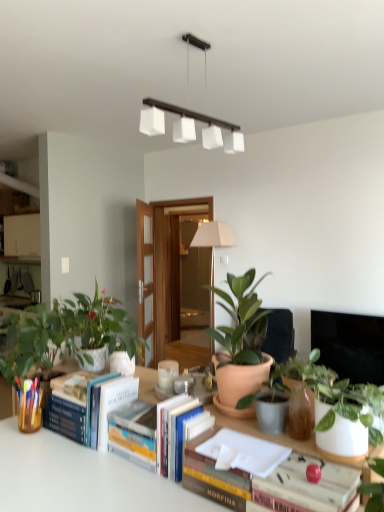
Question: Relative to white matte rectangular light fixture at upper center, is terracotta pot at center, placed as the second houseplant when sorted from right to left, in front or behind?

Choices:
 (A) front
 (B) behind

Answer: (A)

Question: Considering the positions of terracotta pot at center, arranged as the fourth houseplant when viewed from the left, and white matte rectangular light fixture at upper center in the image, is terracotta pot at center, arranged as the fourth houseplant when viewed from the left, taller or shorter than white matte rectangular light fixture at upper center?

Choices:
 (A) tall
 (B) short

Answer: (B)

Question: Which is farther from the hardcover book at center, which is the 2th paperback book in left-to-right order?

Choices:
 (A) green matte plant at left, positioned as the 1th houseplant in left-to-right order
 (B) hardcover book at center, arranged as the 1th book when viewed from the right
 (C) green matte plant at center, arranged as the third houseplant when viewed from the right
 (D) flat screen tv at upper right
 (E) green glossy plant at center, the 1th houseplant in the right-to-left sequence

Answer: (D)

Question: Which of these objects is positioned closest to the green matte plant at center, arranged as the third houseplant when viewed from the right?

Choices:
 (A) hardcover book at center, positioned as the 1th paperback book in front-to-back order
 (B) hardcover book at center, the 1th book positioned from the front
 (C) green glossy plant at center, the 1th houseplant in the right-to-left sequence
 (D) flat screen tv at upper right
 (E) white matte rectangular light fixture at upper center

Answer: (C)